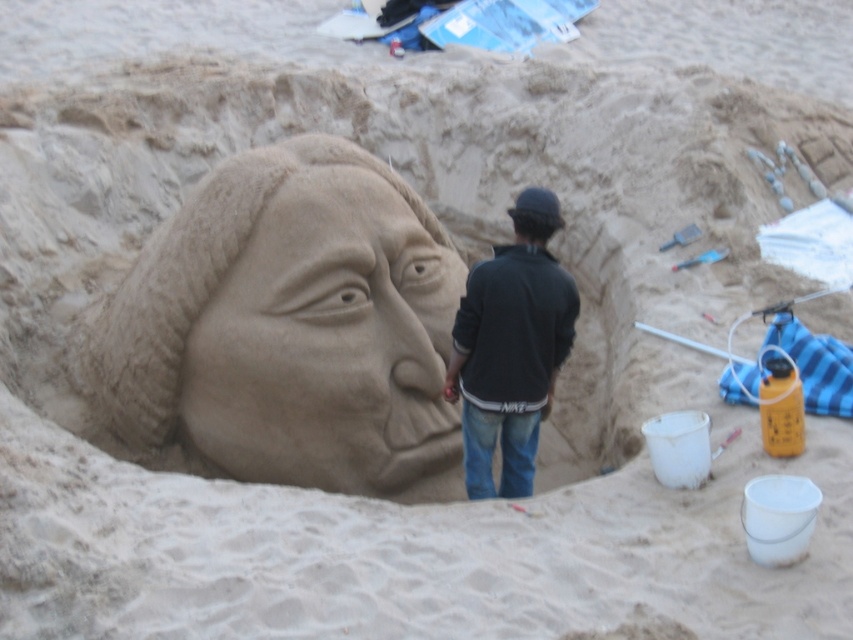
Does point (297, 467) come behind point (469, 444)?

Yes, point (297, 467) is farther from viewer.

Which is more to the right, smooth sand sculpture at center or black cotton jacket at center?

Positioned to the right is black cotton jacket at center.

Identify the location of smooth sand sculpture at center. (328, 342).

Is smooth sand sculpture at center to the right of matte brown sand sculpture at center from the viewer's perspective?

Incorrect, smooth sand sculpture at center is not on the right side of matte brown sand sculpture at center.

Who is higher up, smooth sand sculpture at center or matte brown sand sculpture at center?

matte brown sand sculpture at center is above.

In order to click on smooth sand sculpture at center in this screenshot , I will do `click(328, 342)`.

Is black cotton jacket at center taller than matte brown sand sculpture at center?

Indeed, black cotton jacket at center has a greater height compared to matte brown sand sculpture at center.

Between point (477, 387) and point (538, 209), which one is positioned behind?

The point (477, 387) is behind.

Is point (569, 337) positioned behind point (523, 241)?

Yes.

Where is `black cotton jacket at center`? black cotton jacket at center is located at coordinates (511, 348).